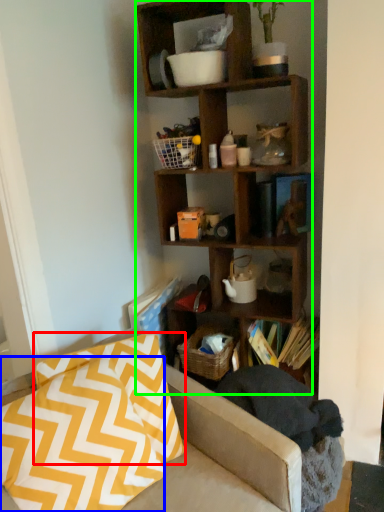
Question: Which object is positioned closest to pillow (highlighted by a red box)? Select from pillow (highlighted by a blue box) and shelf (highlighted by a green box).

Choices:
 (A) pillow
 (B) shelf

Answer: (A)